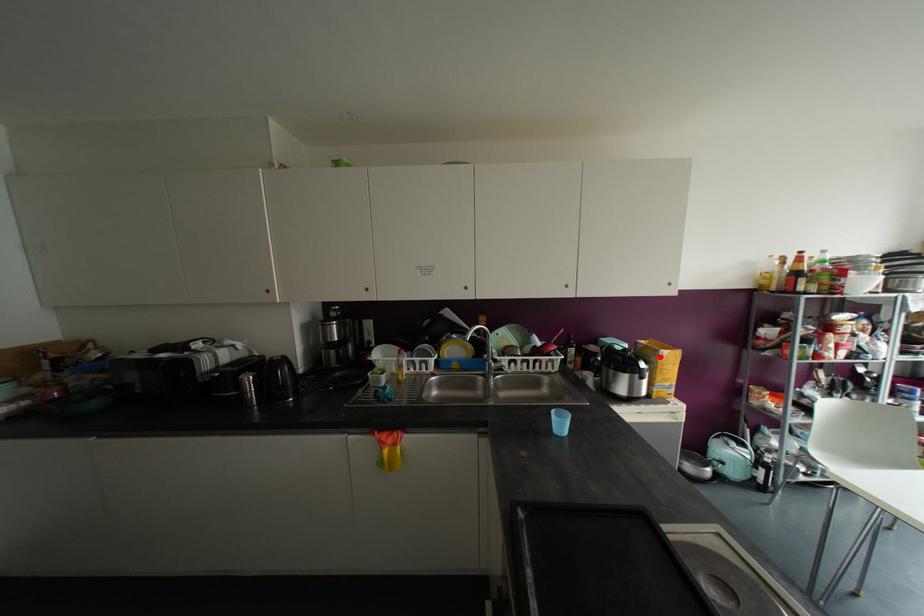
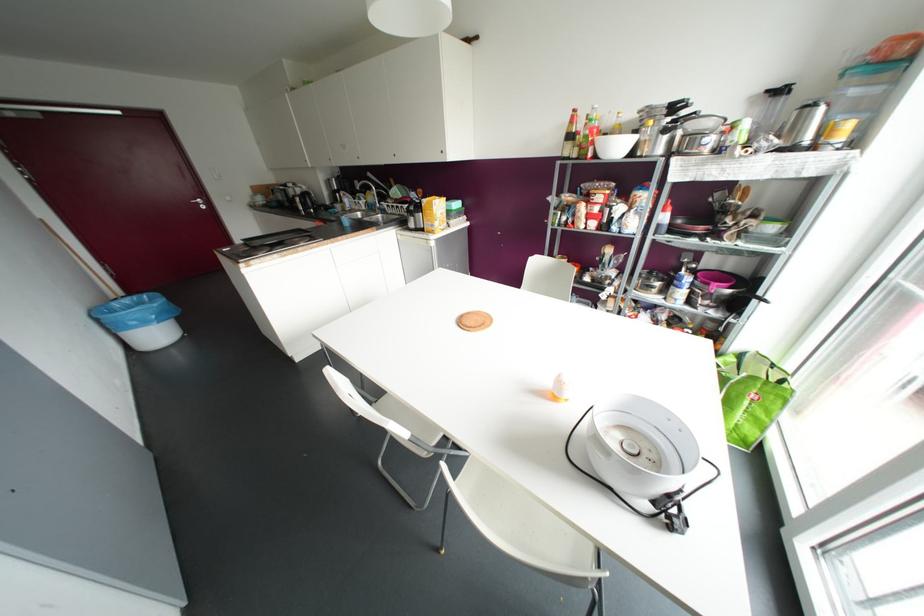
Locate, in the second image, the point that corresponds to the highlighted location in the first image.

(421, 204)